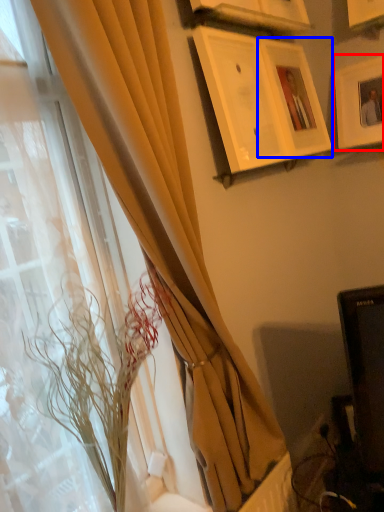
Question: Which of the following is the closest to the observer, picture frame (highlighted by a red box) or picture frame (highlighted by a blue box)?

Choices:
 (A) picture frame
 (B) picture frame

Answer: (B)